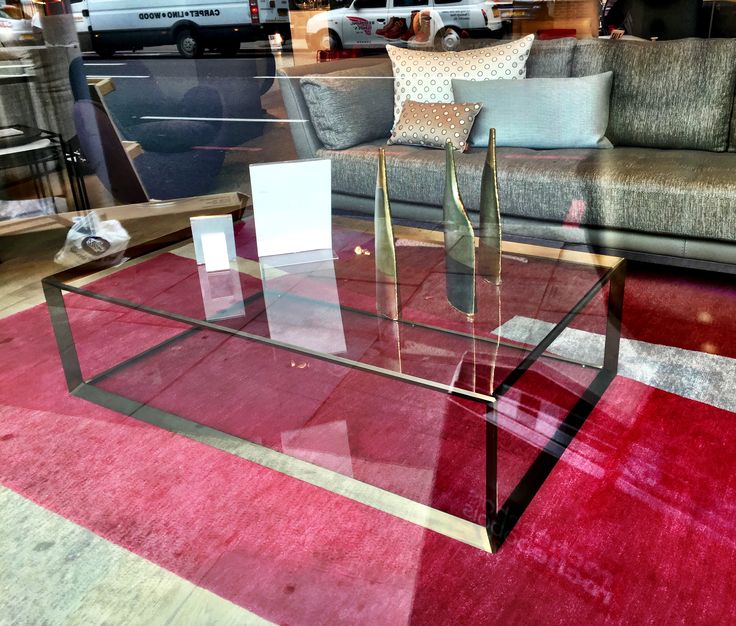
At what (x,y) coordinates should I click in order to perform the action: click on glass (including window reflection). Please return your answer as a coordinate pair (x, y). Looking at the image, I should click on (394, 335), (63, 242).